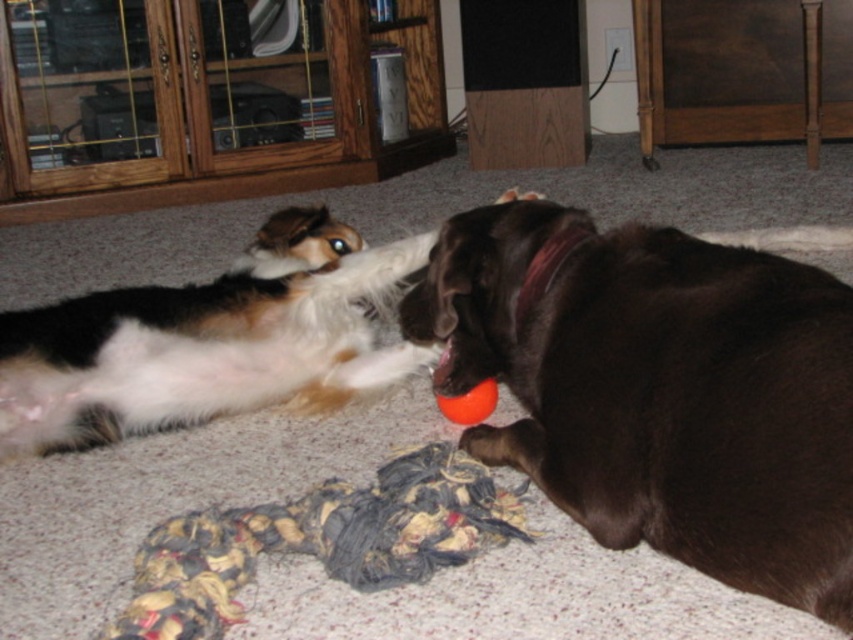
Who is lower down, orange rubber ball at center or rubber ball at lower center?

rubber ball at lower center is lower down.

Does orange rubber ball at center appear on the left side of rubber ball at lower center?

Indeed, orange rubber ball at center is positioned on the left side of rubber ball at lower center.

Between point (457, 416) and point (492, 432), which one is positioned in front?

Point (492, 432) is more forward.

Where is `orange rubber ball at center`? orange rubber ball at center is located at coordinates (469, 403).

Does shiny brown dog at lower right appear under rubber ball at lower center?

Incorrect, shiny brown dog at lower right is not positioned below rubber ball at lower center.

Measure the distance from shiny brown dog at lower right to rubber ball at lower center.

shiny brown dog at lower right and rubber ball at lower center are 30.37 centimeters apart from each other.

This screenshot has width=853, height=640. Describe the element at coordinates (663, 390) in the screenshot. I see `shiny brown dog at lower right` at that location.

Identify the location of shiny brown dog at lower right. (663, 390).

Is point (218, 324) closer to camera compared to point (488, 428)?

That is False.

Between point (177, 333) and point (492, 448), which one is positioned behind?

The point (177, 333) is more distant.

Locate an element on the screen. white fur dog at upper left is located at coordinates (207, 340).

Locate an element on the screen. The width and height of the screenshot is (853, 640). white fur dog at upper left is located at coordinates (207, 340).